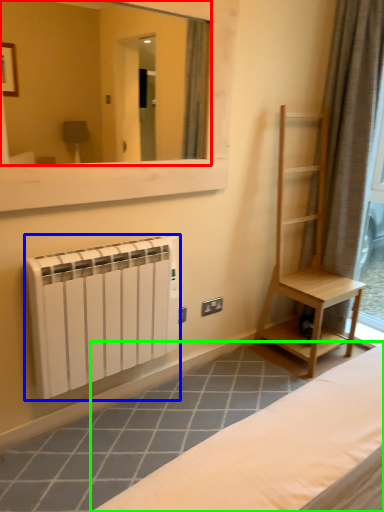
Question: Considering the real-world distances, which object is closest to mirror (highlighted by a red box)? radiator (highlighted by a blue box) or furniture (highlighted by a green box).

Choices:
 (A) radiator
 (B) furniture

Answer: (A)